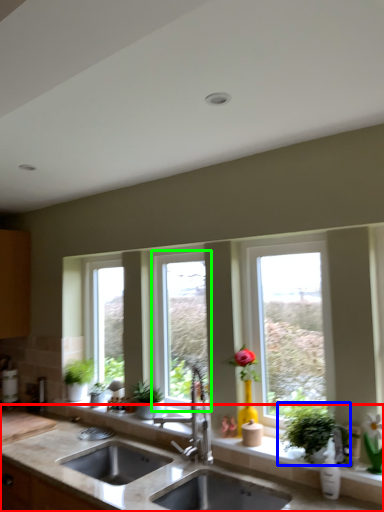
Question: Estimate the real-world distances between objects in this image. Which object is closer to countertop (highlighted by a red box), houseplant (highlighted by a blue box) or window (highlighted by a green box)?

Choices:
 (A) houseplant
 (B) window

Answer: (A)